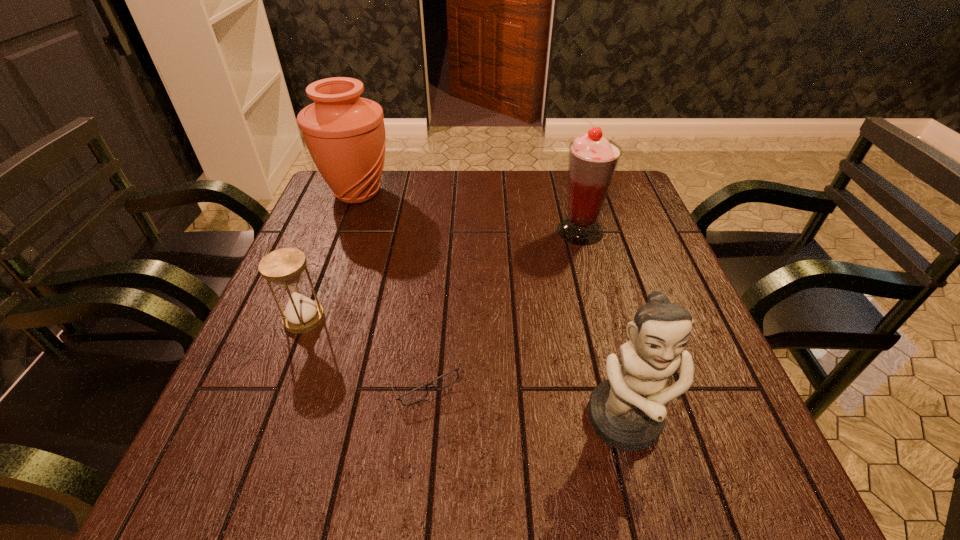
Identify the location of vacant space in between the farthest object and the spectacles. (391, 286).

What are the coordinates of `vacant space in between the smoothie and the figurine` in the screenshot? It's located at (603, 327).

Identify which object is located as the fourth nearest to the shortest object. Please provide its 2D coordinates. Your answer should be formatted as a tuple, i.e. [(x, y)], where the tuple contains the x and y coordinates of a point satisfying the conditions above.

[(345, 134)]

Where is `the closest object relative to the third nearest object`? This screenshot has width=960, height=540. the closest object relative to the third nearest object is located at coordinates (445, 380).